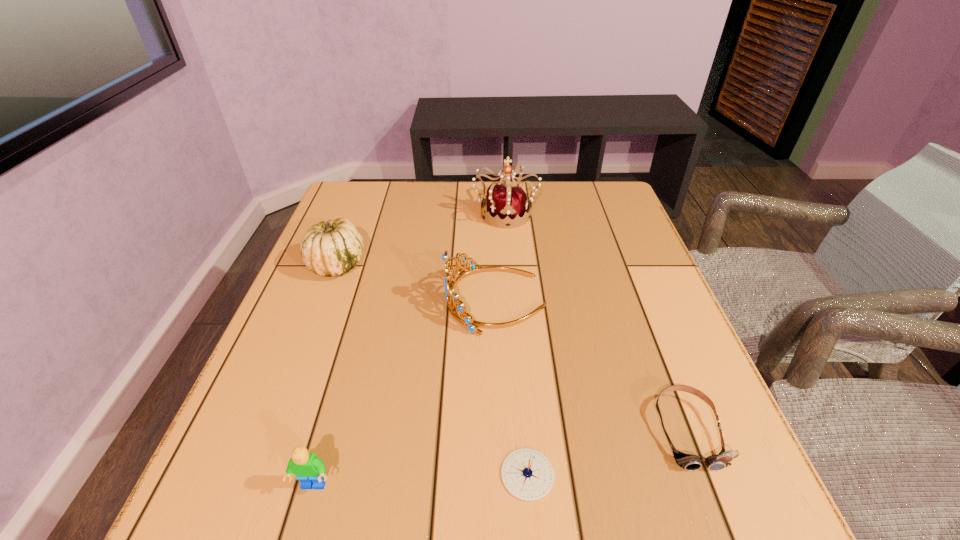
Identify the location of free space between the tallest object and the shorter tiara. (500, 256).

The image size is (960, 540). In order to click on vacant area between the gourd and the Lego in this screenshot , I will do `click(325, 375)`.

You are a GUI agent. You are given a task and a screenshot of the screen. Output one action in this format:
    pyautogui.click(x=<x>, y=<y>)
    Task: Click on the free area in between the gourd and the Lego
    This screenshot has width=960, height=540.
    Given the screenshot: What is the action you would take?
    (325, 375)

Where is `empty space that is in between the nearer tiara and the taller tiara`? This screenshot has width=960, height=540. empty space that is in between the nearer tiara and the taller tiara is located at coordinates (500, 256).

I want to click on free space between the gourd and the goggles, so click(x=512, y=347).

I want to click on free area in between the farther tiara and the shorter tiara, so click(500, 256).

Identify the location of object that stands as the fifth closest to the rightmost object. (330, 248).

Identify which object is the fourth closest to the taller tiara. Please provide its 2D coordinates. Your answer should be formatted as a tuple, i.e. [(x, y)], where the tuple contains the x and y coordinates of a point satisfying the conditions above.

[(527, 474)]

Identify the location of free space that satisfies the following two spatial constraints: 1. on the front-facing side of the compass; 2. on the left side of the tallest object. (526, 474).

I want to click on free spot that satisfies the following two spatial constraints: 1. on the front-facing side of the compass; 2. on the right side of the nearer tiara, so click(502, 474).